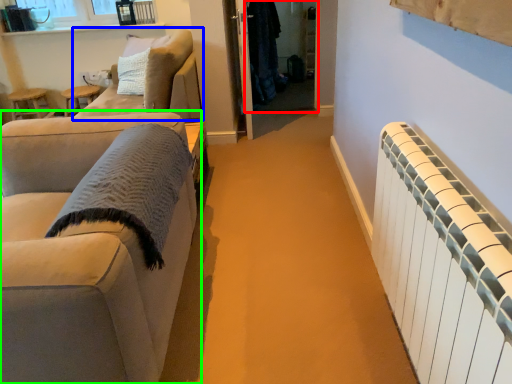
Question: Which object is positioned closest to glass door (highlighted by a red box)? Select from studio couch (highlighted by a blue box) and studio couch (highlighted by a green box).

Choices:
 (A) studio couch
 (B) studio couch

Answer: (A)